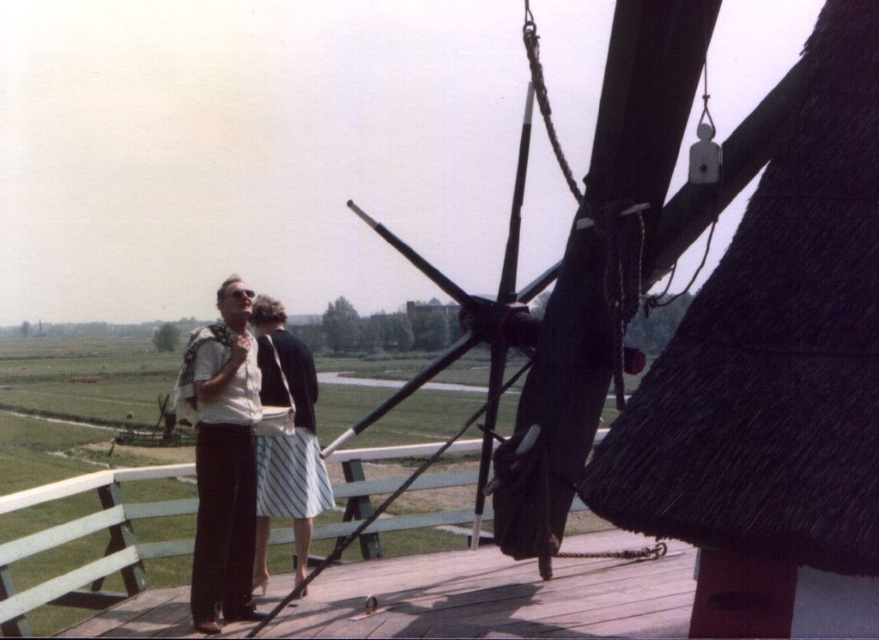
Between white cotton dress at center and striped cotton skirt at center, which one has less height?

striped cotton skirt at center

Based on the photo, between white cotton dress at center and striped cotton skirt at center, which one is positioned higher?

Positioned higher is white cotton dress at center.

Identify the location of white cotton dress at center. (224, 464).

This screenshot has width=879, height=640. What do you see at coordinates (496, 598) in the screenshot?
I see `wooden at center` at bounding box center [496, 598].

You are a GUI agent. You are given a task and a screenshot of the screen. Output one action in this format:
    pyautogui.click(x=<x>, y=<y>)
    Task: Click on the wooden at center
    This screenshot has width=879, height=640.
    Given the screenshot: What is the action you would take?
    pyautogui.click(x=496, y=598)

I want to click on wooden at center, so click(496, 598).

Who is higher up, wooden at center or striped cotton skirt at center?

striped cotton skirt at center

This screenshot has width=879, height=640. I want to click on wooden at center, so click(496, 598).

You are a GUI agent. You are given a task and a screenshot of the screen. Output one action in this format:
    pyautogui.click(x=<x>, y=<y>)
    Task: Click on the wooden at center
    
    Given the screenshot: What is the action you would take?
    pyautogui.click(x=496, y=598)